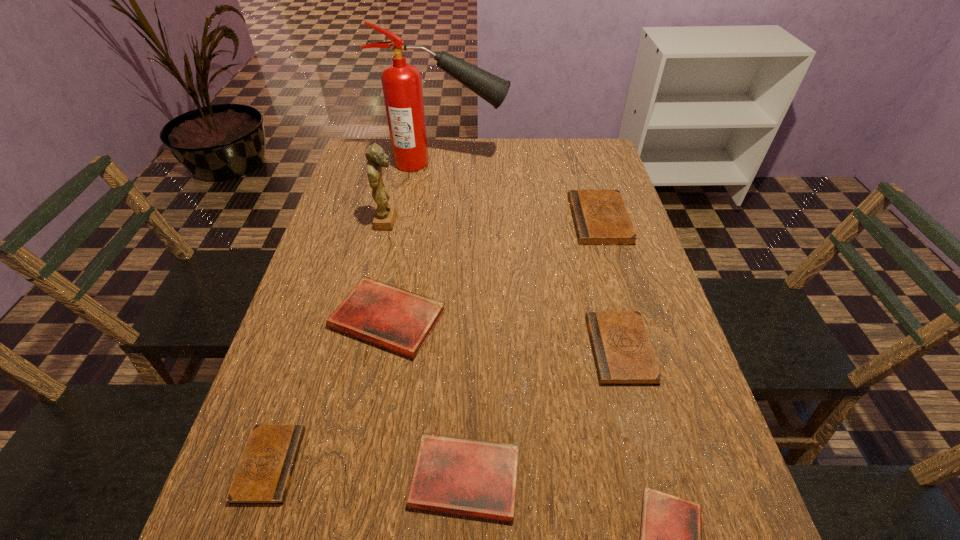
The image size is (960, 540). I want to click on vacant space situated 0.170m at the nozzle of the fire extinguisher, so click(x=557, y=163).

Find the location of a particular element. The height and width of the screenshot is (540, 960). vacant space situated 0.120m on the front-facing side of the seventh shortest object is located at coordinates (441, 221).

Find the location of `free space located 0.390m on the spine side of the farthest diary`. free space located 0.390m on the spine side of the farthest diary is located at coordinates (439, 220).

Image resolution: width=960 pixels, height=540 pixels. Find the location of `free region located 0.290m on the spine side of the farthest diary`. free region located 0.290m on the spine side of the farthest diary is located at coordinates (473, 220).

Locate an element on the screen. The width and height of the screenshot is (960, 540). free location located 0.140m on the spine side of the farthest diary is located at coordinates (525, 220).

Identify the location of vacant point located 0.280m on the front of the farthest red diary. (354, 500).

This screenshot has height=540, width=960. I want to click on vacant space located on the spine side of the second farthest brown diary, so [423, 349].

Locate an element on the screen. This screenshot has height=540, width=960. vacant space located on the spine side of the second farthest brown diary is located at coordinates (501, 349).

In order to click on free space located on the spine side of the second farthest brown diary in this screenshot , I will do `click(551, 349)`.

This screenshot has width=960, height=540. I want to click on vacant area located 0.270m on the right of the second smallest red diary, so click(x=673, y=478).